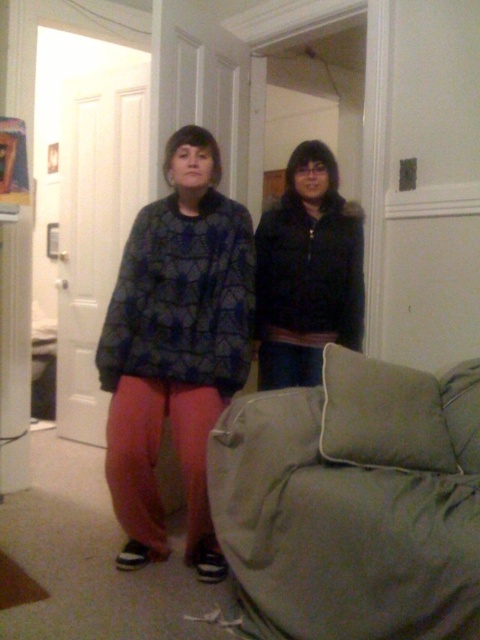
In the scene shown: Which of these two, sage green fabric couch at lower right or matte black jacket at center, stands taller?

matte black jacket at center

Is sage green fabric couch at lower right smaller than matte black jacket at center?

Incorrect, sage green fabric couch at lower right is not smaller in size than matte black jacket at center.

Does point (389, 596) come behind point (177, 390)?

No, it is not.

Find the location of `sage green fabric couch at lower right`. sage green fabric couch at lower right is located at coordinates [354, 502].

This screenshot has height=640, width=480. I want to click on sage green fabric couch at lower right, so click(354, 502).

Can you confirm if sage green fabric couch at lower right is smaller than black matte jacket at center?

No, sage green fabric couch at lower right is not smaller than black matte jacket at center.

Is point (422, 456) behind point (287, 276)?

No, it is in front of (287, 276).

Find the location of `sage green fabric couch at lower right`. sage green fabric couch at lower right is located at coordinates (354, 502).

Who is more forward, (x=205, y=424) or (x=331, y=221)?

Point (x=205, y=424)

Which is in front, point (177, 420) or point (286, 280)?

Point (177, 420) is more forward.

You are a GUI agent. You are given a task and a screenshot of the screen. Output one action in this format:
    pyautogui.click(x=<x>, y=<y>)
    Task: Click on the matte black jacket at center
    The image size is (480, 640).
    Given the screenshot: What is the action you would take?
    pyautogui.click(x=176, y=346)